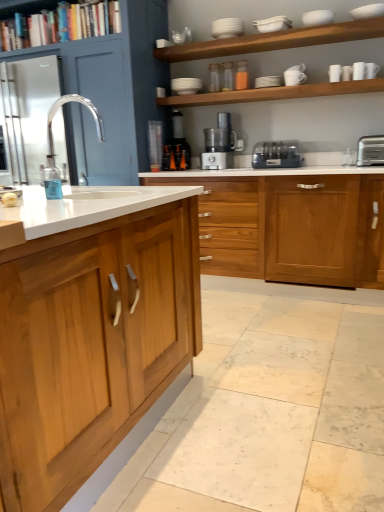
Question: From their relative heights in the image, would you say clear glass faucet at center is taller or shorter than satin black toaster at center, positioned as the 1th home appliance in right-to-left order?

Choices:
 (A) tall
 (B) short

Answer: (A)

Question: Based on their sizes in the image, would you say clear glass faucet at center is bigger or smaller than satin black toaster at center, marked as the 2th home appliance in a left-to-right arrangement?

Choices:
 (A) big
 (B) small

Answer: (B)

Question: Which object is positioned closest to the black plastic coffee machine at center?

Choices:
 (A) wooden cabinet at center, which is the second cabinetry in back-to-front order
 (B) light brown wood cabinet at left, which is counted as the first cabinetry, starting from the front
 (C) satin silver metallic food processor at center, which is the 2th home appliance from right to left
 (D) clear glass faucet at center
 (E) satin black toaster at center, positioned as the 1th home appliance in right-to-left order

Answer: (C)

Question: Which object is the closest to the black plastic coffee machine at center?

Choices:
 (A) clear glass faucet at center
 (B) white matte shelves at upper center, the 2th shelf when ordered from top to bottom
 (C) wooden bookshelf at upper left, the first shelf when ordered from top to bottom
 (D) white glossy shelves at upper center, the third shelf viewed from the top
 (E) silver metallic toaster at right

Answer: (D)